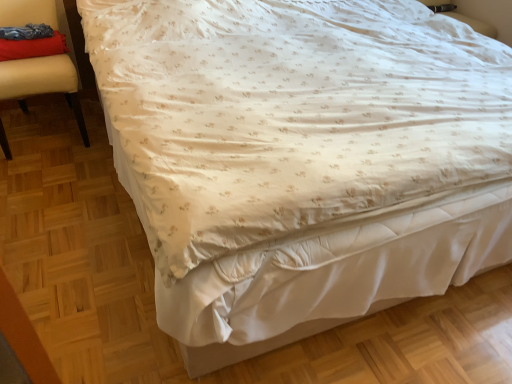
The image size is (512, 384). Identify the location of free point in front of velvet red cushion at left. (48, 178).